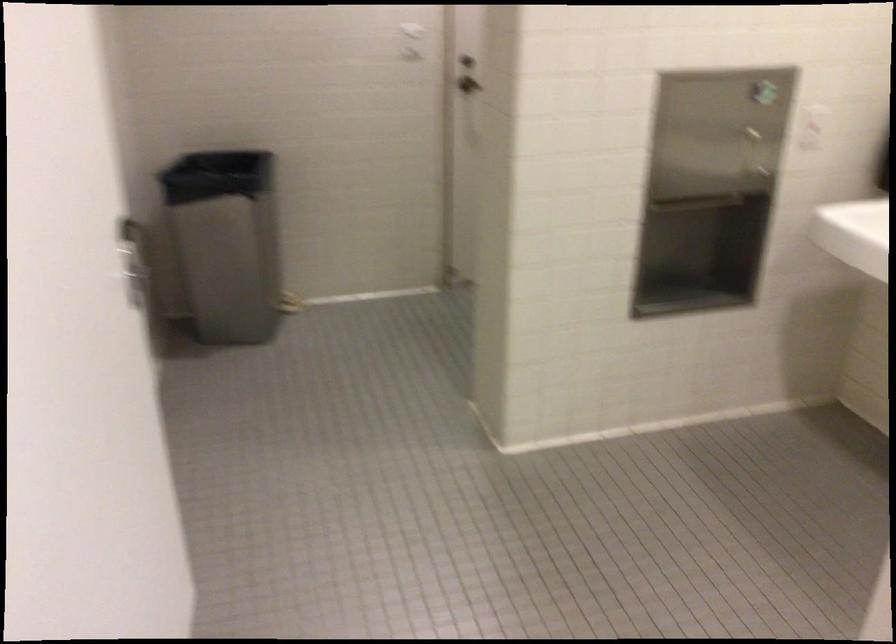
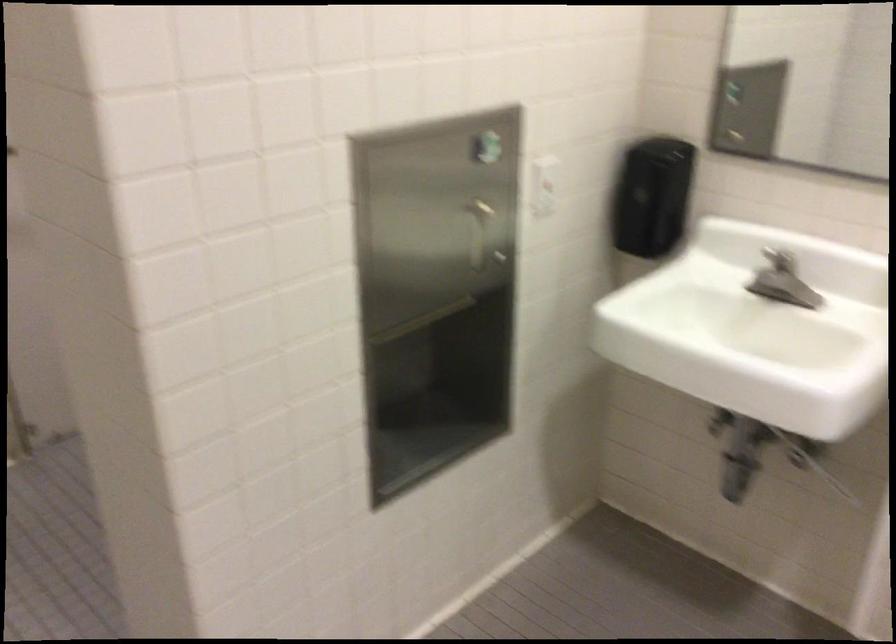
The point at (813, 117) is marked in the first image. Where is the corresponding point in the second image?

(543, 185)